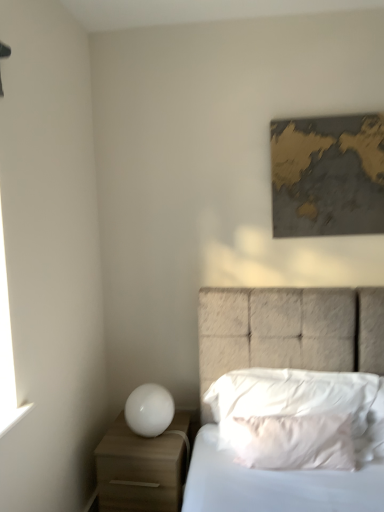
I want to click on vacant area on top of white matte nightstand at lower left (from a real-world perspective), so click(143, 437).